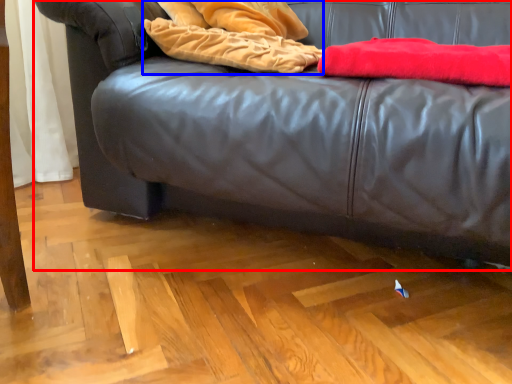
Question: Among these objects, which one is nearest to the camera, studio couch (highlighted by a red box) or blanket (highlighted by a blue box)?

Choices:
 (A) studio couch
 (B) blanket

Answer: (A)